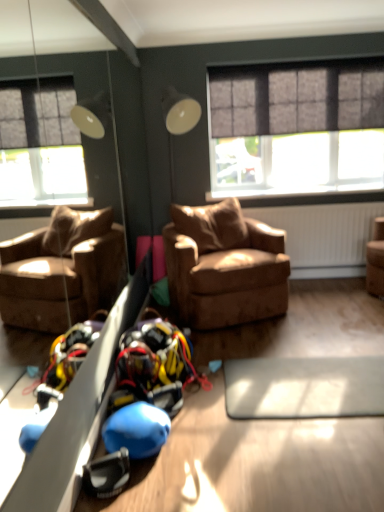
Measure the distance between point (305, 146) and camera.

4.21 meters.

Identify the location of brown leather armchair at center. The width and height of the screenshot is (384, 512). (224, 266).

Which object is thinner, dark gray textured curtain at upper center or brown leather armchair at center?

Thinner between the two is dark gray textured curtain at upper center.

From the image's perspective, is dark gray textured curtain at upper center located above or below brown leather armchair at center?

dark gray textured curtain at upper center is above brown leather armchair at center.

How different are the orientations of dark gray textured curtain at upper center and brown leather armchair at center in degrees?

dark gray textured curtain at upper center and brown leather armchair at center are facing 22.2 degrees away from each other.

Who is shorter, dark gray textured curtain at upper center or brown leather armchair at center?

dark gray textured curtain at upper center.

From a real-world perspective, which is physically above, brown leather armchair at center or dark gray textured curtain at upper center?

From a 3D spatial view, dark gray textured curtain at upper center is above.

Considering the relative positions of brown leather armchair at center and dark gray textured curtain at upper center in the image provided, is brown leather armchair at center to the left of dark gray textured curtain at upper center from the viewer's perspective?

Correct, you'll find brown leather armchair at center to the left of dark gray textured curtain at upper center.

Who is smaller, brown leather armchair at center or dark gray textured curtain at upper center?

With smaller size is dark gray textured curtain at upper center.

Is matte gray window at upper right at the right side of brown leather armchair at center?

Yes.

In terms of width, does matte gray window at upper right look wider or thinner when compared to brown leather armchair at center?

matte gray window at upper right is thinner than brown leather armchair at center.

From the image's perspective, is matte gray window at upper right positioned above or below brown leather armchair at center?

Clearly, from the image's perspective, matte gray window at upper right is above brown leather armchair at center.

Is dark gray textured curtain at upper center not inside matte gray window at upper right?

Absolutely, dark gray textured curtain at upper center is external to matte gray window at upper right.

In the scene shown: Can you confirm if dark gray textured curtain at upper center is wider than matte gray window at upper right?

Indeed, dark gray textured curtain at upper center has a greater width compared to matte gray window at upper right.

From the picture: Is dark gray textured curtain at upper center at the right side of matte gray window at upper right?

No, dark gray textured curtain at upper center is not to the right of matte gray window at upper right.

From the image's perspective, is matte gray window at upper right on dark gray textured curtain at upper center?

No, from the image's perspective, matte gray window at upper right is not over dark gray textured curtain at upper center.

In terms of height, does matte gray window at upper right look taller or shorter compared to dark gray textured curtain at upper center?

matte gray window at upper right is taller than dark gray textured curtain at upper center.

Which of these two, matte gray window at upper right or dark gray textured curtain at upper center, is smaller?

With smaller size is dark gray textured curtain at upper center.

Does point (267, 130) lie behind point (242, 111)?

Yes, it is.

Which object is thinner, brown leather armchair at center or matte gray window at upper right?

With smaller width is matte gray window at upper right.

From a real-world perspective, which object rests below the other?

From a 3D spatial view, brown leather armchair at center is below.

Does brown leather armchair at center appear on the right side of matte gray window at upper right?

In fact, brown leather armchair at center is to the left of matte gray window at upper right.

Is point (286, 309) positioned behind point (263, 78)?

No, it is not.

Locate an element on the screen. curtain on the right of brown leather armchair at center is located at coordinates (296, 100).

Find the location of a particular element. studio couch below the dark gray textured curtain at upper center (from the image's perspective) is located at coordinates (224, 266).

When comparing their distances from matte gray window at upper right, does brown leather armchair at center or dark gray textured curtain at upper center seem further?

brown leather armchair at center.

When comparing their distances from matte gray window at upper right, does dark gray textured curtain at upper center or brown leather armchair at center seem further?

The object further to matte gray window at upper right is brown leather armchair at center.

Looking at the image, which one is located further to dark gray textured curtain at upper center, matte gray window at upper right or brown leather armchair at center?

brown leather armchair at center.

Based on their spatial positions, is dark gray textured curtain at upper center or matte gray window at upper right further from brown leather armchair at center?

The object further to brown leather armchair at center is dark gray textured curtain at upper center.

Which object lies further to the anchor point brown leather armchair at center, matte gray window at upper right or dark gray textured curtain at upper center?

dark gray textured curtain at upper center is further to brown leather armchair at center.

Based on their spatial positions, is brown leather armchair at center or matte gray window at upper right closer to dark gray textured curtain at upper center?

matte gray window at upper right.

This screenshot has height=512, width=384. In order to click on window between dark gray textured curtain at upper center and brown leather armchair at center vertically in this screenshot , I will do `click(296, 129)`.